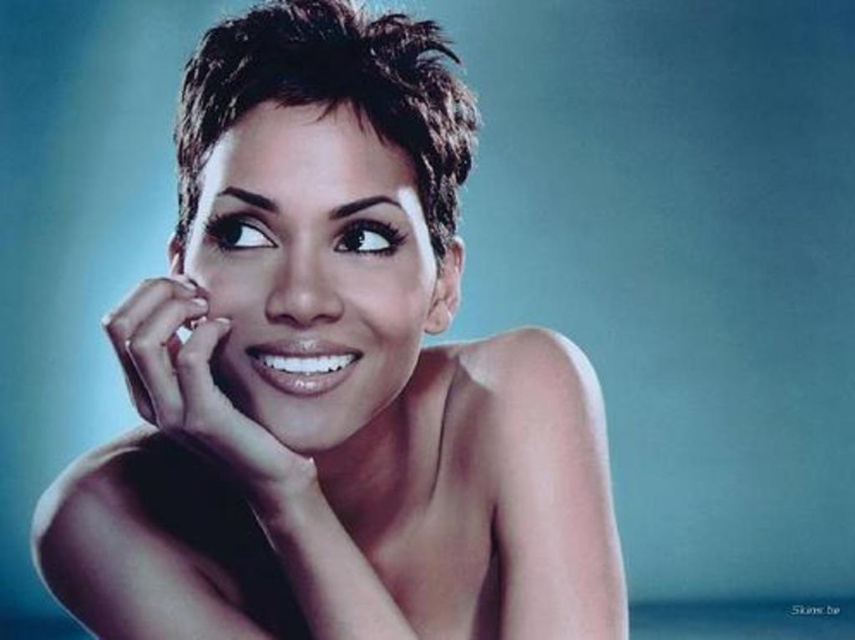
Does smooth skin woman at center come in front of smooth skin hand at center?

Yes, smooth skin woman at center is in front of smooth skin hand at center.

Is smooth skin woman at center taller than smooth skin hand at center?

Yes, smooth skin woman at center is taller than smooth skin hand at center.

What are the coordinates of `smooth skin woman at center` in the screenshot? It's located at (332, 378).

The image size is (855, 640). I want to click on smooth skin woman at center, so click(332, 378).

Can you confirm if smooth skin woman at center is smaller than dark brown textured hair at center?

No, smooth skin woman at center is not smaller than dark brown textured hair at center.

Is point (249, 611) in front of point (190, 99)?

No, it is behind (190, 99).

Does point (590, 456) come closer to viewer compared to point (410, 122)?

No, it is not.

Find the location of a particular element. Image resolution: width=855 pixels, height=640 pixels. smooth skin woman at center is located at coordinates (332, 378).

Is dark brown textured hair at center further to the viewer compared to smooth skin hand at center?

Yes.

The image size is (855, 640). What do you see at coordinates (332, 92) in the screenshot?
I see `dark brown textured hair at center` at bounding box center [332, 92].

This screenshot has width=855, height=640. Find the location of `dark brown textured hair at center`. dark brown textured hair at center is located at coordinates (332, 92).